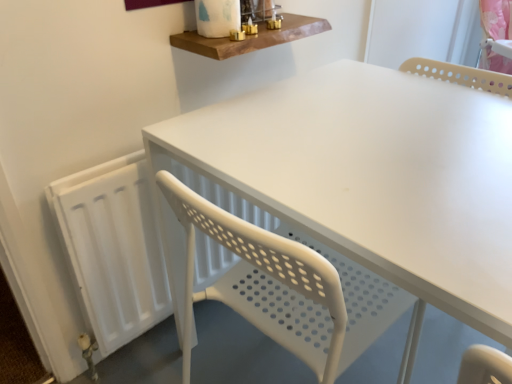
Identify the location of white matte table at center. This screenshot has height=384, width=512. (374, 176).

Describe the element at coordinates (113, 248) in the screenshot. The height and width of the screenshot is (384, 512). I see `white matte radiator at left` at that location.

Find the location of `white matte table at center`. white matte table at center is located at coordinates (374, 176).

Considering the relative sizes of white matte radiator at left and white matte table at center in the image provided, is white matte radiator at left taller than white matte table at center?

No.

Can you confirm if white matte radiator at left is smaller than white matte table at center?

Yes.

Considering the positions of point (78, 203) and point (428, 126), is point (78, 203) closer or farther from the camera than point (428, 126)?

Point (78, 203) appears to be farther away from the viewer than point (428, 126).

From a real-world perspective, which is physically above, wooden shelf at upper center or white matte table at center?

wooden shelf at upper center, from a real-world perspective.

Between wooden shelf at upper center and white matte table at center, which one has larger size?

Bigger between the two is white matte table at center.

Does wooden shelf at upper center have a lesser height compared to white matte table at center?

Indeed, wooden shelf at upper center has a lesser height compared to white matte table at center.

What's the angular difference between wooden shelf at upper center and white matte table at center's facing directions?

89.5 degrees separate the facing orientations of wooden shelf at upper center and white matte table at center.

Consider the image. Is white matte radiator at left bigger than wooden shelf at upper center?

Correct, white matte radiator at left is larger in size than wooden shelf at upper center.

From a real-world perspective, which object stands above the other?

From a 3D spatial view, wooden shelf at upper center is above.

In the image, is white matte radiator at left on the left side or the right side of wooden shelf at upper center?

white matte radiator at left is to the left of wooden shelf at upper center.

Does white matte radiator at left have a lesser width compared to wooden shelf at upper center?

Indeed, white matte radiator at left has a lesser width compared to wooden shelf at upper center.

Would you consider white matte table at center to be distant from white matte radiator at left?

Actually, white matte table at center and white matte radiator at left are a little close together.

Is white matte table at center positioned beyond the bounds of white matte radiator at left?

Absolutely, white matte table at center is external to white matte radiator at left.

Which is behind, point (183, 137) or point (108, 332)?

The point (108, 332) is behind.

In the scene shown: In terms of size, does white matte table at center appear bigger or smaller than white matte radiator at left?

Considering their sizes, white matte table at center takes up more space than white matte radiator at left.

Can you see white matte table at center touching wooden shelf at upper center?

There is a gap between white matte table at center and wooden shelf at upper center.

Is point (465, 255) closer to viewer compared to point (196, 42)?

Yes, point (465, 255) is in front of point (196, 42).

Would you say wooden shelf at upper center is part of white matte table at center's contents?

Actually, wooden shelf at upper center is outside white matte table at center.

Can you confirm if white matte table at center is taller than wooden shelf at upper center?

Correct, white matte table at center is much taller as wooden shelf at upper center.

Does point (225, 42) come behind point (137, 224)?

No, it is in front of (137, 224).

Considering the relative sizes of wooden shelf at upper center and white matte radiator at left in the image provided, is wooden shelf at upper center wider than white matte radiator at left?

Yes.

Considering the relative positions of wooden shelf at upper center and white matte radiator at left in the image provided, is wooden shelf at upper center to the left or to the right of white matte radiator at left?

Clearly, wooden shelf at upper center is on the right of white matte radiator at left in the image.

Locate an element on the screen. The image size is (512, 384). table lying in front of the white matte radiator at left is located at coordinates (374, 176).

Locate an element on the screen. This screenshot has width=512, height=384. shelf that appears behind the white matte table at center is located at coordinates (251, 37).

Considering their positions, is white matte table at center positioned further to white matte radiator at left than wooden shelf at upper center?

wooden shelf at upper center is positioned further to the anchor white matte radiator at left.

Estimate the real-world distances between objects in this image. Which object is closer to wooden shelf at upper center, white matte radiator at left or white matte table at center?

white matte table at center.

When comparing their distances from white matte table at center, does white matte radiator at left or wooden shelf at upper center seem further?

white matte radiator at left is positioned further to the anchor white matte table at center.

Based on their spatial positions, is white matte table at center or white matte radiator at left closer to wooden shelf at upper center?

white matte table at center.

Estimate the real-world distances between objects in this image. Which object is closer to white matte table at center, wooden shelf at upper center or white matte radiator at left?

wooden shelf at upper center.

Estimate the real-world distances between objects in this image. Which object is further from white matte radiator at left, wooden shelf at upper center or white matte table at center?

Among the two, wooden shelf at upper center is located further to white matte radiator at left.

Where is `radiator between wooden shelf at upper center and white matte table at center vertically`? Image resolution: width=512 pixels, height=384 pixels. radiator between wooden shelf at upper center and white matte table at center vertically is located at coordinates (113, 248).